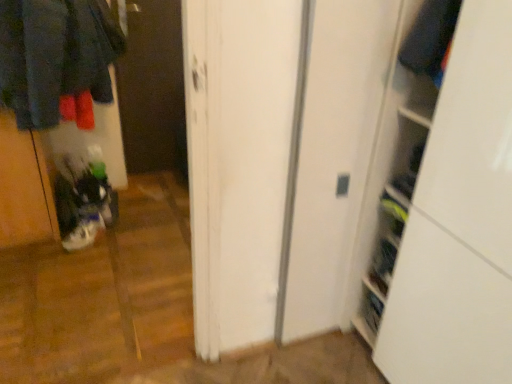
Question: Does velvet-like dark blue sweater at upper right come behind dark wood screen door at center?

Choices:
 (A) no
 (B) yes

Answer: (A)

Question: Is velvet-like dark blue sweater at upper right at the right side of dark wood screen door at center?

Choices:
 (A) no
 (B) yes

Answer: (B)

Question: Can you confirm if velvet-like dark blue sweater at upper right is wider than dark wood screen door at center?

Choices:
 (A) yes
 (B) no

Answer: (A)

Question: From the image's perspective, is velvet-like dark blue sweater at upper right under dark wood screen door at center?

Choices:
 (A) yes
 (B) no

Answer: (A)

Question: From a real-world perspective, is velvet-like dark blue sweater at upper right beneath dark wood screen door at center?

Choices:
 (A) no
 (B) yes

Answer: (A)

Question: Can you confirm if velvet-like dark blue sweater at upper right is shorter than dark wood screen door at center?

Choices:
 (A) no
 (B) yes

Answer: (B)

Question: Could dark wood screen door at center be considered to be inside white matte sneakers at lower left?

Choices:
 (A) yes
 (B) no

Answer: (B)

Question: Does white matte sneakers at lower left lie in front of dark wood screen door at center?

Choices:
 (A) no
 (B) yes

Answer: (B)

Question: Does white matte sneakers at lower left have a smaller size compared to dark wood screen door at center?

Choices:
 (A) yes
 (B) no

Answer: (A)

Question: Considering the relative sizes of white matte sneakers at lower left and dark wood screen door at center in the image provided, is white matte sneakers at lower left taller than dark wood screen door at center?

Choices:
 (A) yes
 (B) no

Answer: (B)

Question: From a real-world perspective, does white matte sneakers at lower left stand above dark wood screen door at center?

Choices:
 (A) yes
 (B) no

Answer: (B)

Question: Can you see white matte sneakers at lower left touching dark wood screen door at center?

Choices:
 (A) yes
 (B) no

Answer: (B)

Question: Is velvet-like dark blue sweater at upper right inside dark wood screen door at center?

Choices:
 (A) no
 (B) yes

Answer: (A)